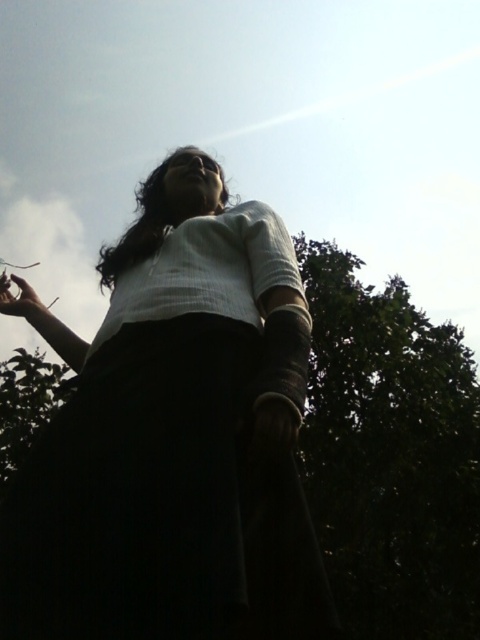
Based on the scene description, can you determine which object, the white matte shirt at center or the matte black phone at upper left, is bigger in size?

The white matte shirt at center is larger in size than the matte black phone at upper left according to the description.

You are a photographer trying to capture the person in the image. The person is standing in a park with a dense tree canopy overhead. You notice a point at coordinates (173,438). What object is located at that point?

The point at coordinates (173,438) indicates the white matte shirt at center.

You are a photographer trying to capture the white matte shirt at center and the matte black phone at upper left in a single frame. Based on their sizes in the image, which object would likely occupy more space in the photo?

The white matte shirt at center would occupy more space in the photo since it might be wider than the matte black phone at upper left.